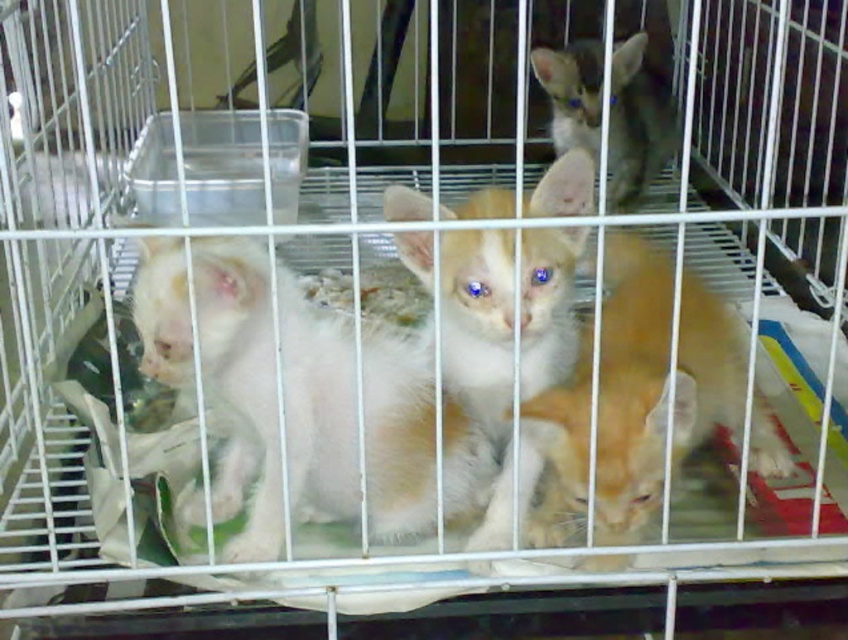
Which is more to the left, orange fur cat at center or gray fur cat at upper center?

Positioned to the left is orange fur cat at center.

Does point (670, 296) come behind point (586, 83)?

No, (670, 296) is closer to viewer.

Is point (693, 400) more distant than point (637, 33)?

No, it is in front of (637, 33).

In order to click on orange fur cat at center in this screenshot , I will do `click(631, 388)`.

Looking at this image, can you confirm if fluffy white kitten at center is positioned below transparent plastic container at center?

Correct, fluffy white kitten at center is located below transparent plastic container at center.

Measure the distance from fluffy white kitten at center to transparent plastic container at center.

fluffy white kitten at center is 23.59 inches from transparent plastic container at center.

You are a GUI agent. You are given a task and a screenshot of the screen. Output one action in this format:
    pyautogui.click(x=<x>, y=<y>)
    Task: Click on the fluffy white kitten at center
    This screenshot has width=848, height=640.
    Given the screenshot: What is the action you would take?
    pyautogui.click(x=481, y=353)

Can you confirm if transparent plastic container at center is thinner than gray fur cat at upper center?

Incorrect, transparent plastic container at center's width is not less than gray fur cat at upper center's.

Is transparent plastic container at center bigger than gray fur cat at upper center?

Indeed, transparent plastic container at center has a larger size compared to gray fur cat at upper center.

At what (x,y) coordinates should I click in order to perform the action: click on transparent plastic container at center. Please return your answer as a coordinate pair (x, y). Looking at the image, I should click on click(x=218, y=166).

What are the coordinates of `transparent plastic container at center` in the screenshot? It's located at (218, 166).